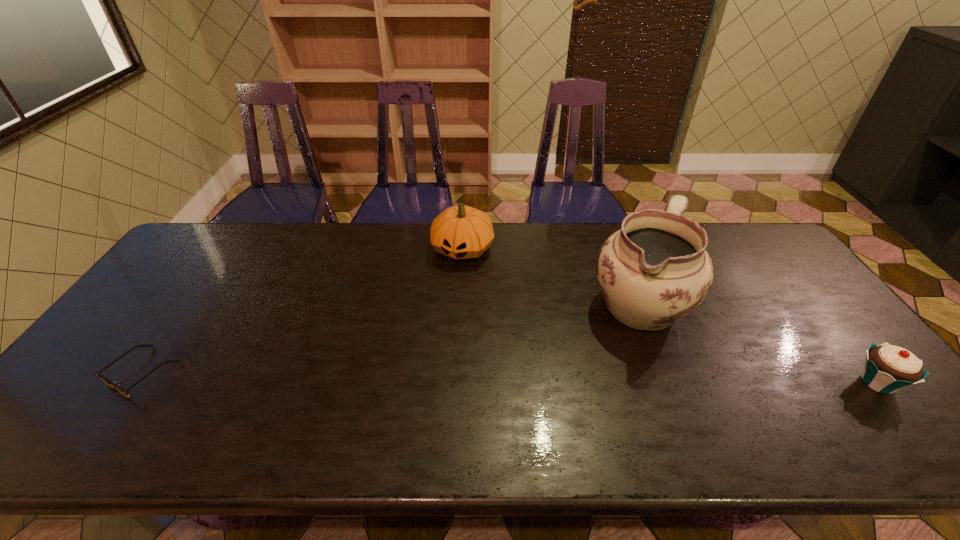
I want to click on blank area located 0.400m on the side of the second object from left to right with the carved face, so click(414, 368).

Where is `free space located 0.180m on the side of the second object from left to right with the carved face`? Image resolution: width=960 pixels, height=540 pixels. free space located 0.180m on the side of the second object from left to right with the carved face is located at coordinates (439, 307).

This screenshot has width=960, height=540. I want to click on vacant region located 0.180m on the spout of the tallest object, so 585,381.

Identify the location of vacant space situated 0.210m on the spout of the tallest object. (579, 389).

Find the location of a particular element. The height and width of the screenshot is (540, 960). blank space located on the spout of the tallest object is located at coordinates (605, 353).

You are a GUI agent. You are given a task and a screenshot of the screen. Output one action in this format:
    pyautogui.click(x=<x>, y=<y>)
    Task: Click on the object located at the far edge
    
    Given the screenshot: What is the action you would take?
    pyautogui.click(x=461, y=232)

Find the location of a particular element. sunglasses that is at the near edge is located at coordinates (109, 382).

At what (x,y) coordinates should I click in order to perform the action: click on cupcake at the near edge. Please return your answer as a coordinate pair (x, y). The height and width of the screenshot is (540, 960). Looking at the image, I should click on (888, 368).

This screenshot has width=960, height=540. Identify the location of object at the left edge. (109, 382).

Image resolution: width=960 pixels, height=540 pixels. In order to click on object that is at the right edge in this screenshot , I will do `click(888, 368)`.